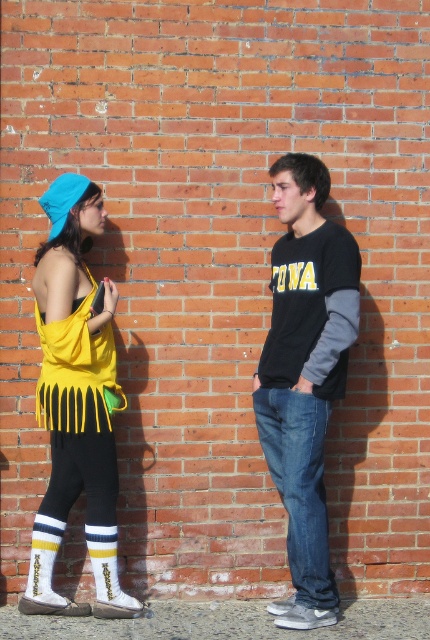
Question: Observing the image, what is the correct spatial positioning of yellow striped socks at lower left in reference to striped wool sock at lower left?

Choices:
 (A) left
 (B) right

Answer: (A)

Question: Considering the real-world distances, which object is closest to the striped wool sock at lower left?

Choices:
 (A) black cotton shirt at center
 (B) yellow fringe tank top at left
 (C) denim jeans at center
 (D) yellow fringe dress at left

Answer: (D)

Question: Among these objects, which one is nearest to the camera?

Choices:
 (A) yellow fringe tank top at left
 (B) denim jeans at center
 (C) yellow fringe dress at left
 (D) striped wool sock at lower left

Answer: (C)

Question: Can you confirm if yellow fringe tank top at left is wider than denim jeans at center?

Choices:
 (A) yes
 (B) no

Answer: (A)

Question: Which point is closer to the camera taking this photo?

Choices:
 (A) (36, 584)
 (B) (94, 545)

Answer: (B)

Question: Is yellow fringe tank top at left above black cotton shirt at center?

Choices:
 (A) no
 (B) yes

Answer: (A)